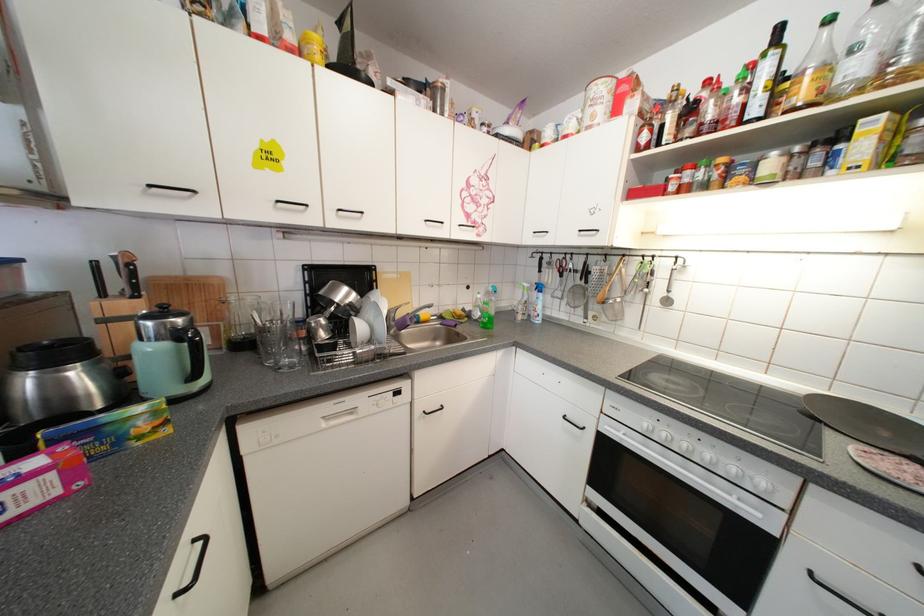
The location [521,302] corresponds to which object?

It corresponds to the green spray bottle in the image.